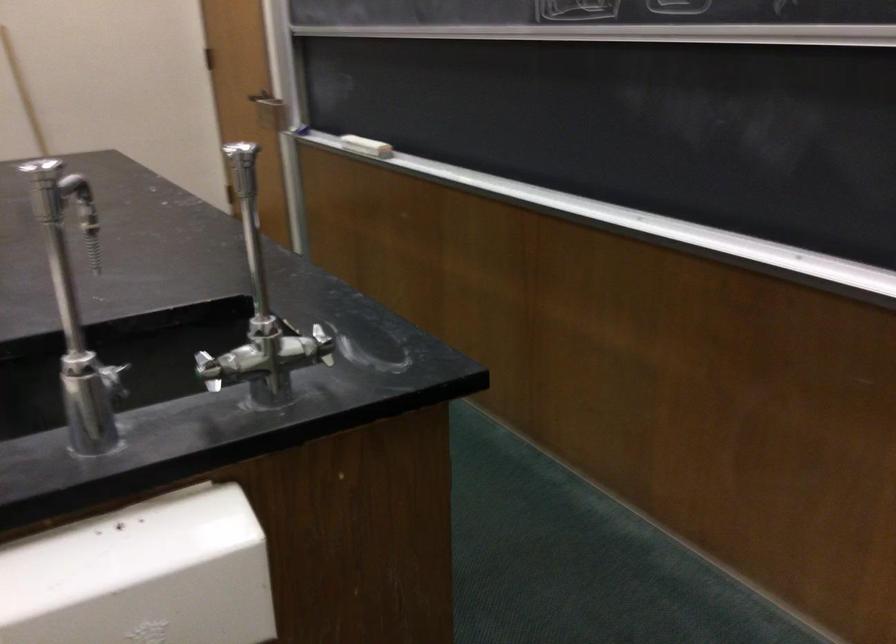
Where would you lift the white chalkboard eraser? Please return your answer as a coordinate pair (x, y).

(366, 146)